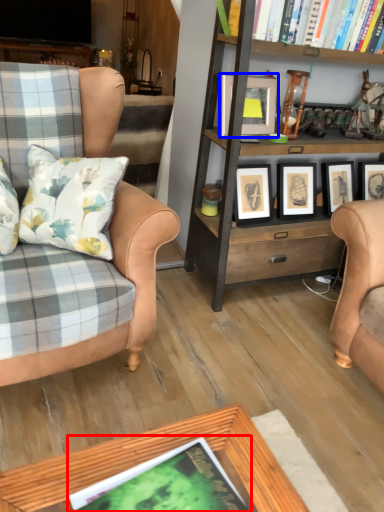
Question: Among these objects, which one is farthest to the camera, book (highlighted by a red box) or picture frame (highlighted by a blue box)?

Choices:
 (A) book
 (B) picture frame

Answer: (B)